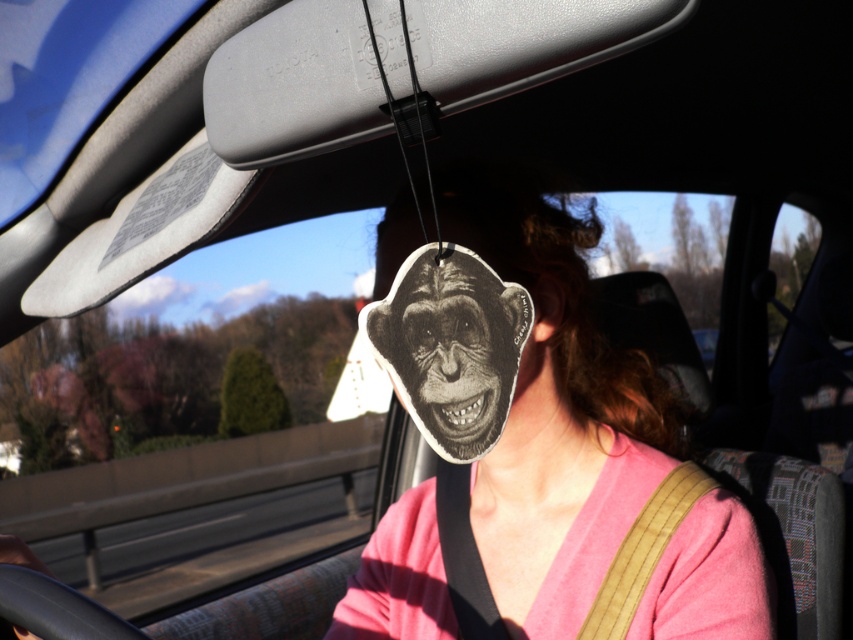
Question: Which of the following is the closest to the observer?

Choices:
 (A) matte paper monkey face at center
 (B) black paper monkey face at center

Answer: (B)

Question: Is matte paper monkey face at center wider than black paper monkey face at center?

Choices:
 (A) no
 (B) yes

Answer: (B)

Question: Can you confirm if matte paper monkey face at center is smaller than black paper monkey face at center?

Choices:
 (A) no
 (B) yes

Answer: (A)

Question: Which of the following is the closest to the observer?

Choices:
 (A) (509, 282)
 (B) (451, 180)

Answer: (A)

Question: Does matte paper monkey face at center appear on the right side of black paper monkey face at center?

Choices:
 (A) no
 (B) yes

Answer: (B)